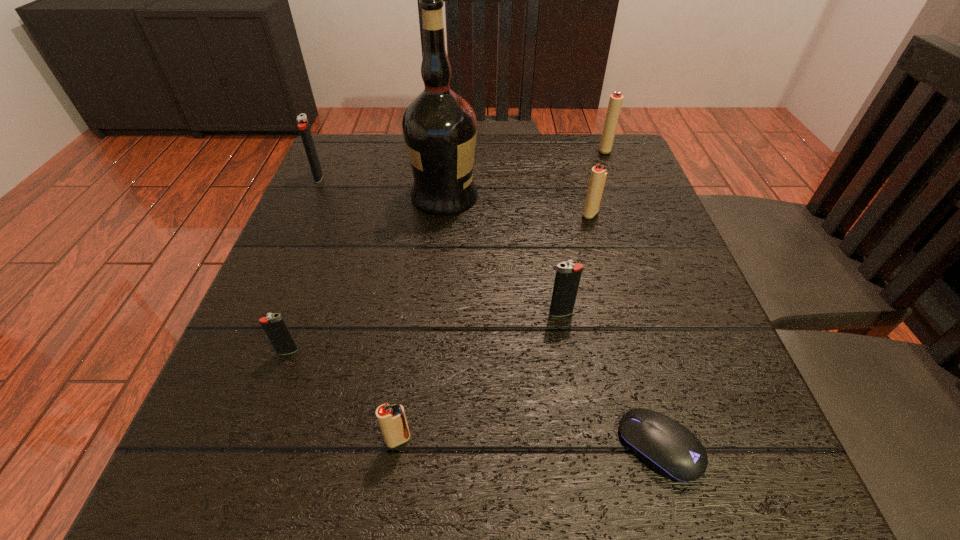
The image size is (960, 540). What are the coordinates of `free space located on the right of the fourth igniter from right to left` in the screenshot? It's located at (551, 440).

In order to click on vacant space situated 0.340m on the back of the fifth igniter from right to left in this screenshot , I will do `click(337, 214)`.

The width and height of the screenshot is (960, 540). I want to click on free space located on the left of the black computer mouse, so click(x=366, y=447).

Locate an element on the screen. liquor at the far edge is located at coordinates (440, 127).

The width and height of the screenshot is (960, 540). Find the location of `igniter that is positioned at the near edge`. igniter that is positioned at the near edge is located at coordinates (392, 419).

This screenshot has height=540, width=960. What are the coordinates of `computer mouse positioned at the near edge` in the screenshot? It's located at (669, 448).

Locate an element on the screen. computer mouse present at the right edge is located at coordinates (669, 448).

The image size is (960, 540). In order to click on object that is positioned at the far left corner in this screenshot , I will do `click(303, 126)`.

The width and height of the screenshot is (960, 540). I want to click on object at the far right corner, so click(x=615, y=102).

Where is `object at the near right corner`? object at the near right corner is located at coordinates (669, 448).